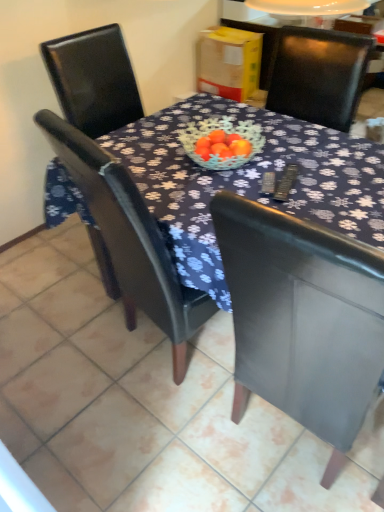
Question: Considering the positions of matte black chair at center, the 2th chair positioned from the left, and matte black chair at center, arranged as the 2th chair when viewed from the right, in the image, is matte black chair at center, the 2th chair positioned from the left, bigger or smaller than matte black chair at center, arranged as the 2th chair when viewed from the right,?

Choices:
 (A) big
 (B) small

Answer: (B)

Question: Considering their positions, is matte black chair at center, the first chair from the right, located in front of or behind matte black chair at center, arranged as the 2th chair when viewed from the right?

Choices:
 (A) behind
 (B) front

Answer: (B)

Question: Would you say matte black chair at center, the first chair from the right, is inside or outside matte black chair at center, arranged as the 2th chair when viewed from the right?

Choices:
 (A) inside
 (B) outside

Answer: (B)

Question: Based on their positions, is matte black chair at center, arranged as the 2th chair when viewed from the right, located to the left or right of matte black chair at center, the 2th chair positioned from the left?

Choices:
 (A) left
 (B) right

Answer: (A)

Question: Would you say matte black chair at center, marked as the 1th chair in a left-to-right arrangement, is inside or outside matte black chair at center, the 2th chair positioned from the left?

Choices:
 (A) inside
 (B) outside

Answer: (B)

Question: From a real-world perspective, relative to matte black chair at center, the 2th chair positioned from the left, is matte black chair at center, arranged as the 2th chair when viewed from the right, vertically above or below?

Choices:
 (A) below
 (B) above

Answer: (B)

Question: Considering the positions of matte black chair at center, arranged as the 2th chair when viewed from the right, and matte black chair at center, the first chair from the right, in the image, is matte black chair at center, arranged as the 2th chair when viewed from the right, taller or shorter than matte black chair at center, the first chair from the right,?

Choices:
 (A) tall
 (B) short

Answer: (B)